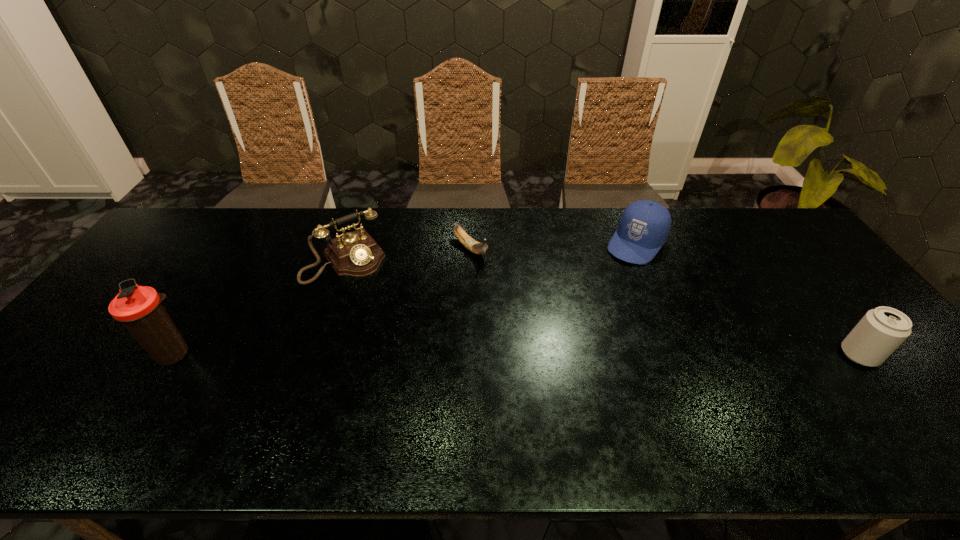
The image size is (960, 540). What are the coordinates of `free space in the image that satisfies the following two spatial constraints: 1. on the back side of the fourth object from right to left; 2. on the right side of the fourth object from left to right` in the screenshot? It's located at (350, 244).